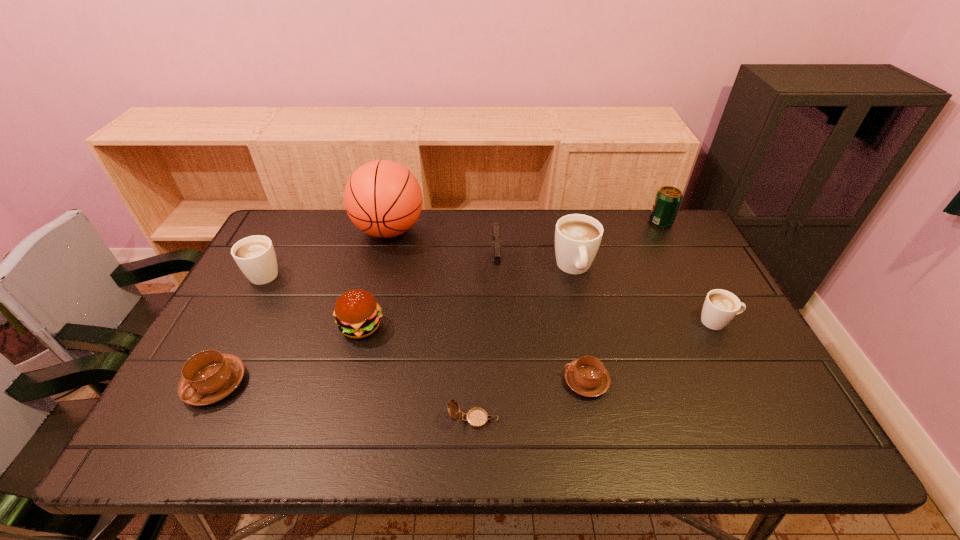
I want to click on vacant space located 0.180m with the handle on the side of the leftmost white cappuccino, so click(292, 223).

At what (x,y) coordinates should I click in order to perform the action: click on vacant space located 0.160m with the handle on the side of the leftmost white cappuccino. Please return your answer as a coordinate pair (x, y). This screenshot has width=960, height=540. Looking at the image, I should click on (290, 226).

Where is `vacant region located on the back of the hamburger`? The width and height of the screenshot is (960, 540). vacant region located on the back of the hamburger is located at coordinates (383, 241).

The width and height of the screenshot is (960, 540). What are the coordinates of `free space located 0.330m on the face of the compass` in the screenshot? It's located at (645, 420).

The width and height of the screenshot is (960, 540). I want to click on vacant region located on the side of the shortest cappuccino with the handle, so click(x=444, y=381).

Where is `vacant point located on the side of the shortest cappuccino with the handle`? This screenshot has height=540, width=960. vacant point located on the side of the shortest cappuccino with the handle is located at coordinates click(x=539, y=381).

Where is `free region located on the side of the shortest cappuccino with the handle`? The width and height of the screenshot is (960, 540). free region located on the side of the shortest cappuccino with the handle is located at coordinates (465, 381).

At what (x,y) coordinates should I click in order to perform the action: click on basketball that is at the far edge. Please return your answer as a coordinate pair (x, y). The width and height of the screenshot is (960, 540). Looking at the image, I should click on (382, 198).

At what (x,y) coordinates should I click in order to perform the action: click on cappuccino present at the far edge. Please return your answer as a coordinate pair (x, y). This screenshot has height=540, width=960. Looking at the image, I should click on (577, 237).

Find the location of `beer can situated at the far edge`. beer can situated at the far edge is located at coordinates (668, 199).